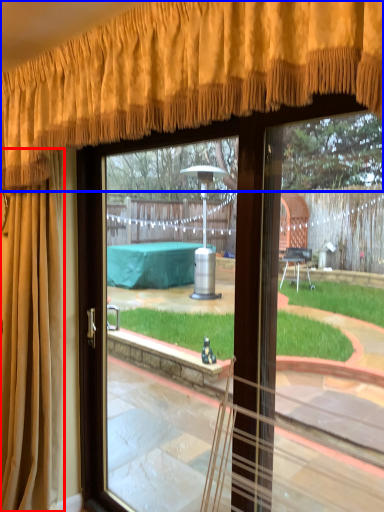
Question: Which object is further to the camera taking this photo, curtain (highlighted by a red box) or curtain (highlighted by a blue box)?

Choices:
 (A) curtain
 (B) curtain

Answer: (A)